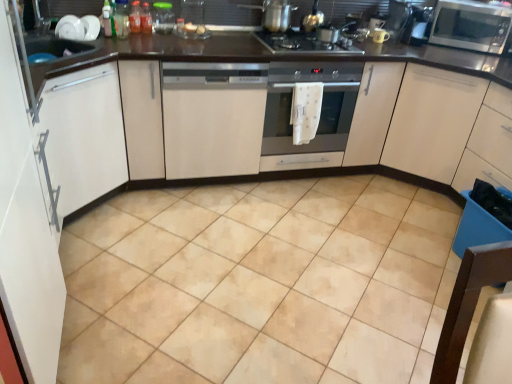
Locate an element on the screen. The image size is (512, 384). free space in front of translucent plastic bottle at upper center, which is counted as the third bottle, starting from the right is located at coordinates (118, 45).